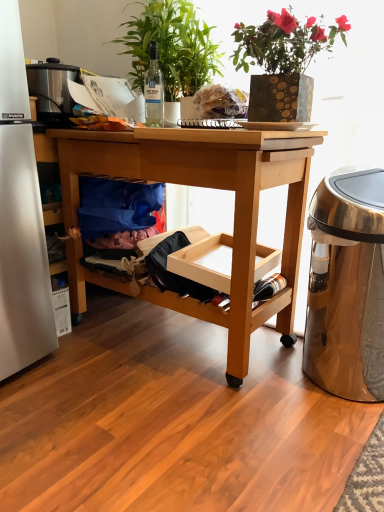
I want to click on free space to the left of shiny metallic trash can at right, so click(251, 380).